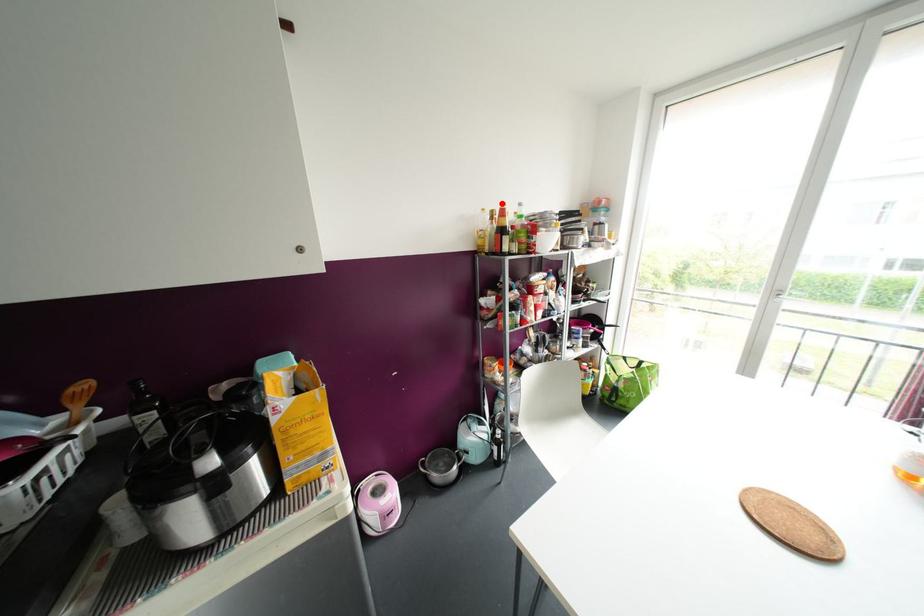
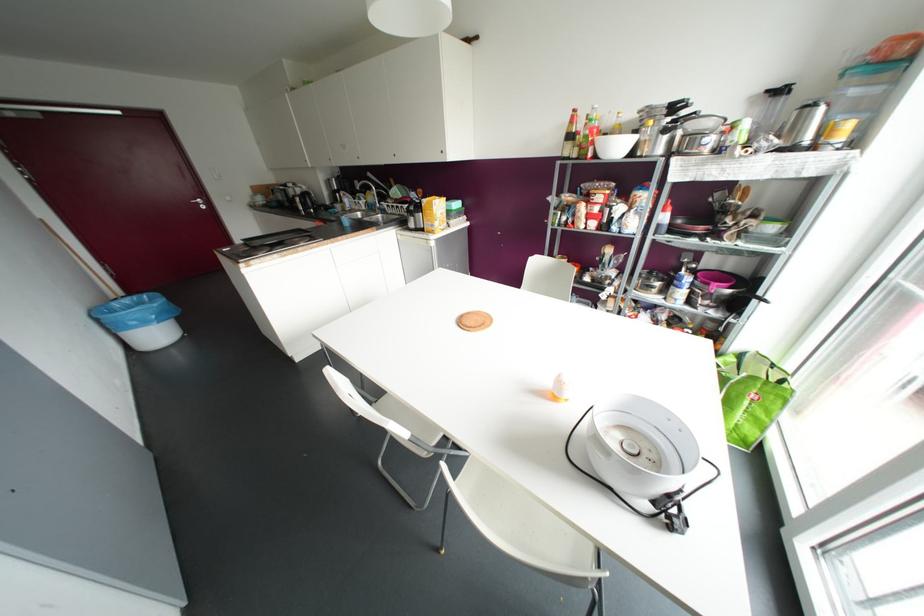
Find the pixel in the second image that matches the highlighted location in the first image.

(574, 110)